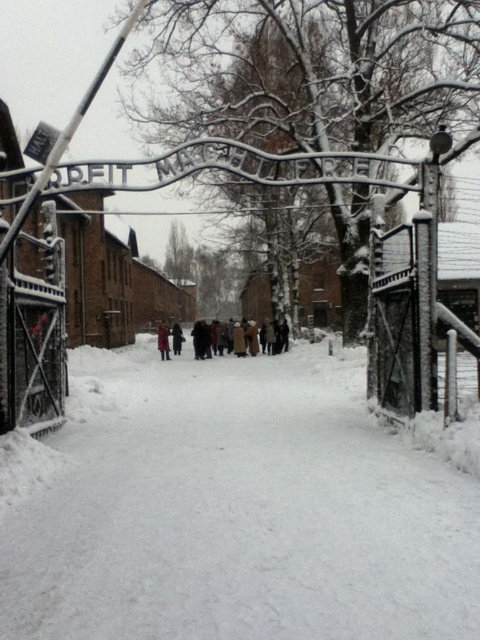
Question: Which object is positioned closest to the brown wool coat at center?

Choices:
 (A) white powdery snow at center
 (B) red wool coat at center

Answer: (B)

Question: Can you confirm if white powdery snow at center is smaller than brown wool coat at center?

Choices:
 (A) yes
 (B) no

Answer: (A)

Question: Is white powdery snow at center further to the viewer compared to brown wool coat at center?

Choices:
 (A) no
 (B) yes

Answer: (A)

Question: Among these points, which one is farthest from the camera?

Choices:
 (A) coord(276,339)
 (B) coord(159,344)

Answer: (A)

Question: Based on their relative distances, which object is nearer to the white powdery snow at center?

Choices:
 (A) red wool coat at center
 (B) brown wool coat at center

Answer: (B)

Question: Where is white powdery snow at center located in relation to red wool coat at center in the image?

Choices:
 (A) above
 (B) below

Answer: (B)